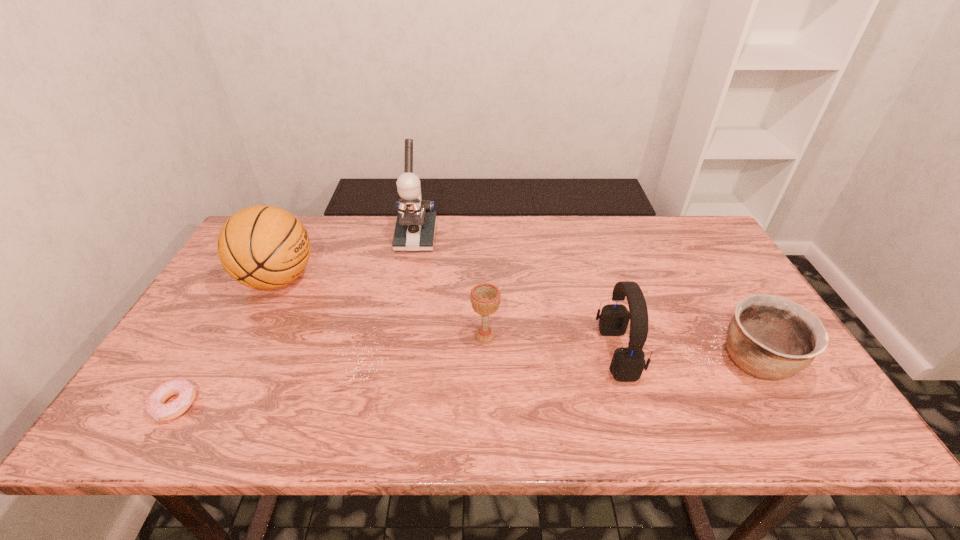
I want to click on vacant area situated on the headband of the headset, so click(506, 353).

Locate an element on the screen. Image resolution: width=960 pixels, height=540 pixels. vacant region located on the headband of the headset is located at coordinates (506, 353).

You are a GUI agent. You are given a task and a screenshot of the screen. Output one action in this format:
    pyautogui.click(x=<x>, y=<y>)
    Task: Click on the vacant space positioned on the left of the chalice
    
    Given the screenshot: What is the action you would take?
    pyautogui.click(x=349, y=336)

Identify the location of free space located on the back of the pottery. (721, 301).

Where is `vacant space situated on the back of the doughnut`? vacant space situated on the back of the doughnut is located at coordinates point(241,294).

This screenshot has height=540, width=960. I want to click on microscope present at the far edge, so click(x=415, y=227).

The width and height of the screenshot is (960, 540). Identify the location of basketball present at the far edge. (263, 247).

You are a GUI agent. You are given a task and a screenshot of the screen. Output one action in this format:
    pyautogui.click(x=<x>, y=<y>)
    Task: Click on the object that is positioned at the near edge
    Image resolution: width=960 pixels, height=540 pixels.
    Given the screenshot: What is the action you would take?
    pyautogui.click(x=155, y=406)

Identify the location of basketball present at the left edge. (263, 247).

Where is `doughnut at the left edge`? Image resolution: width=960 pixels, height=540 pixels. doughnut at the left edge is located at coordinates (155, 406).